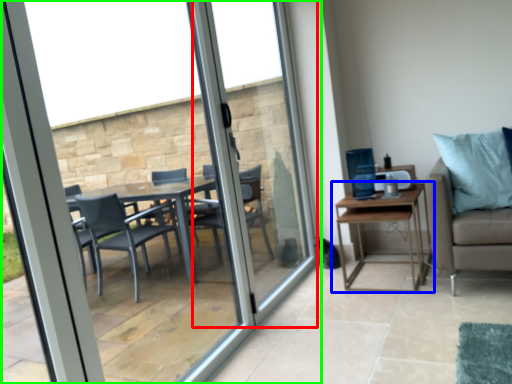
Question: Based on their relative distances, which object is farther from screen door (highlighted by a red box)? Choose from table (highlighted by a blue box) and window (highlighted by a green box).

Choices:
 (A) table
 (B) window

Answer: (A)